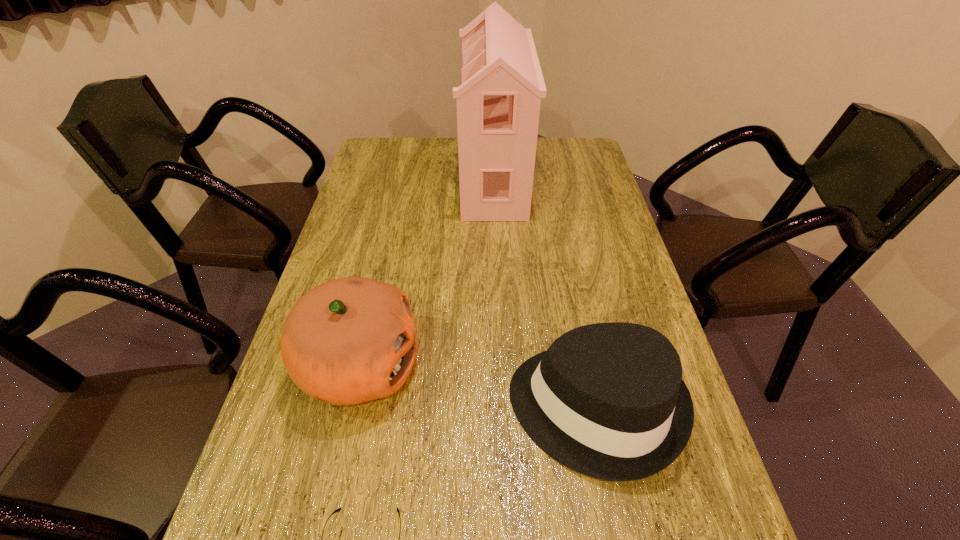
The height and width of the screenshot is (540, 960). What are the coordinates of `object that is at the left edge` in the screenshot? It's located at (350, 340).

The width and height of the screenshot is (960, 540). Find the location of `object present at the right edge`. object present at the right edge is located at coordinates (607, 400).

Locate an element on the screen. This screenshot has width=960, height=540. vacant space at the far edge is located at coordinates (447, 166).

This screenshot has width=960, height=540. Find the location of `vacant space at the left edge of the desktop`. vacant space at the left edge of the desktop is located at coordinates (337, 249).

This screenshot has width=960, height=540. Find the location of `vacant space at the right edge of the desktop`. vacant space at the right edge of the desktop is located at coordinates (596, 202).

Identify the location of vacant space at the far left corner of the desktop. This screenshot has width=960, height=540. (405, 158).

Identify the location of vacant space in between the fedora and the second tallest object. 477,387.

The height and width of the screenshot is (540, 960). In order to click on free point between the dollhouse and the fedora in this screenshot , I will do `click(544, 293)`.

Where is `free spot between the second tallest object and the farthest object`? The image size is (960, 540). free spot between the second tallest object and the farthest object is located at coordinates (426, 272).

You are a GUI agent. You are given a task and a screenshot of the screen. Output one action in this format:
    pyautogui.click(x=<x>, y=<y>)
    Task: Click on the free point between the third shortest object and the fedora
    The width and height of the screenshot is (960, 540).
    Given the screenshot: What is the action you would take?
    pyautogui.click(x=477, y=387)